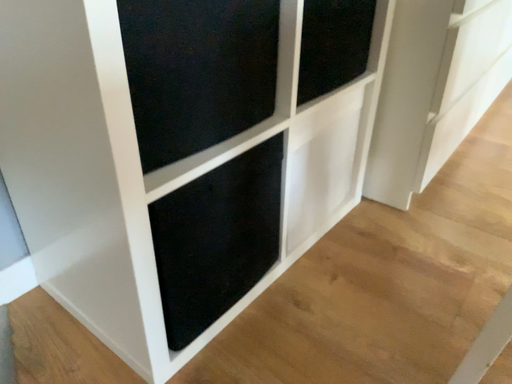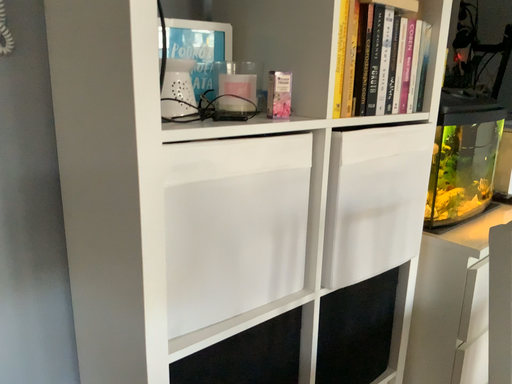
Question: Which way did the camera rotate in the video?

Choices:
 (A) rotated upward
 (B) rotated downward

Answer: (A)